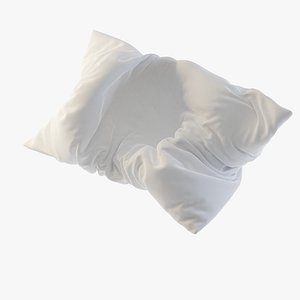
Locate an element on the screen. upper right corner of the pillow is located at coordinates (285, 114).